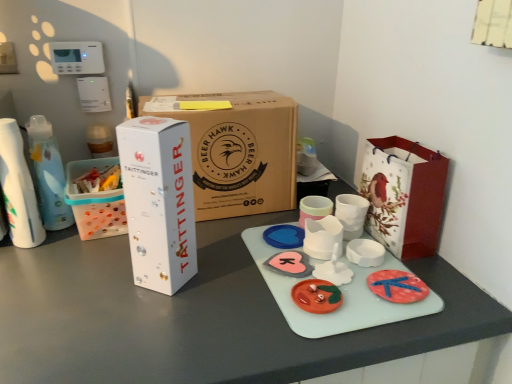
Where is `unoccupied space behind pink matte heart at center, arranged as the 2th toy when viewed from the back`? Image resolution: width=512 pixels, height=384 pixels. unoccupied space behind pink matte heart at center, arranged as the 2th toy when viewed from the back is located at coordinates (262, 225).